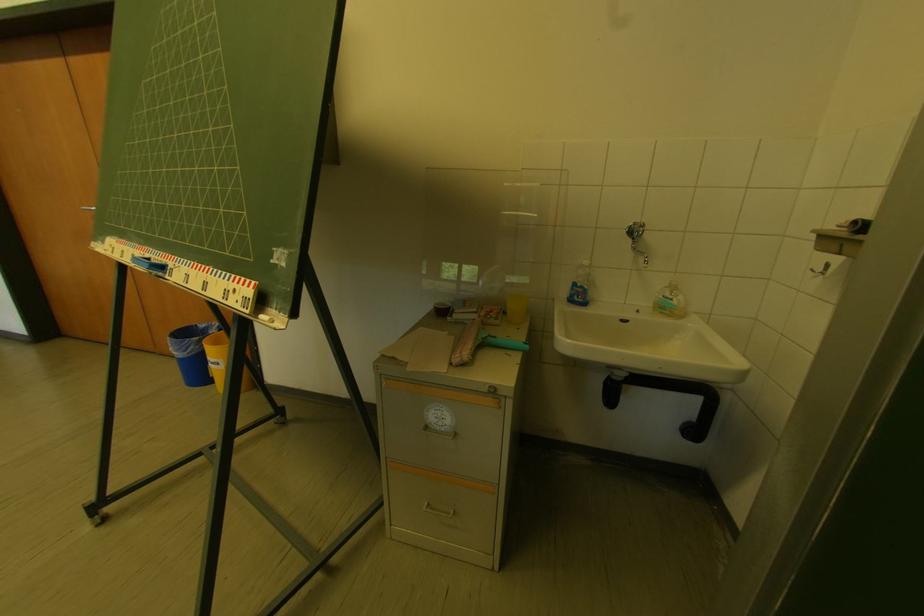
Locate an element on the screen. This screenshot has height=616, width=924. metal faucet handle is located at coordinates (635, 231).